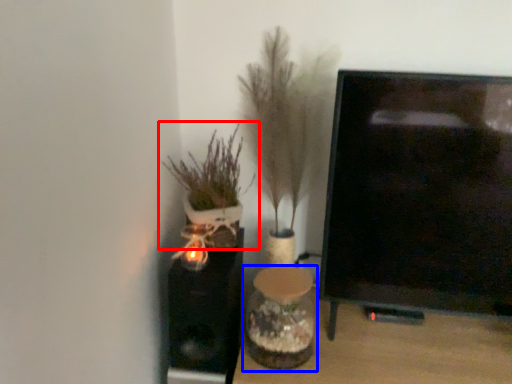
Question: Among these objects, which one is farthest to the camera, houseplant (highlighted by a red box) or vase (highlighted by a blue box)?

Choices:
 (A) houseplant
 (B) vase

Answer: (A)